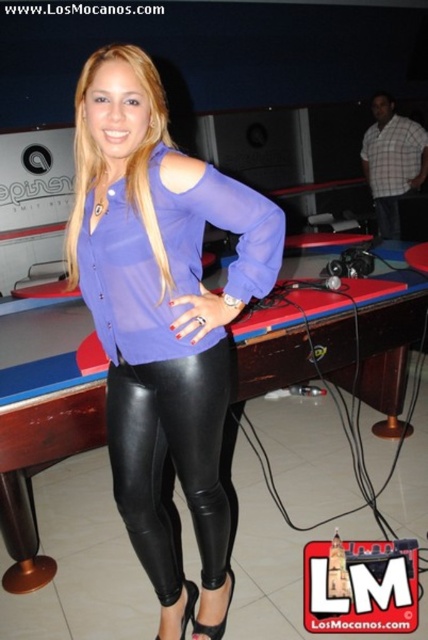
You are at a venue with a pool table and microphone stand. You want to place a 1.6 meter long banner between the camera and the point at coordinates point (175, 573). Will the banner fit without overlapping anything?

The distance between the camera and point (175, 573) is 1.59 meters. Since the banner is 1.6 meters long, it will slightly overlap the area beyond the point when placed there.

You are at a venue with a woman wearing a light purple blouse and black leather leggings. You see a point marked at coordinates (39, 468). What object is located at that point?

The point at coordinates (39, 468) indicates the black leather billiard table at center.

You are planning to place a rectangular box that is 2 meters wide on the black leather billiard table at center. Considering the black leather leggings at center are also on the table, can the box fit on the table without overlapping the leggings?

The black leather billiard table at center has a width larger than the black leather leggings at center, so the box can fit on the table without overlapping the leggings as long as there is enough space around the leggings.